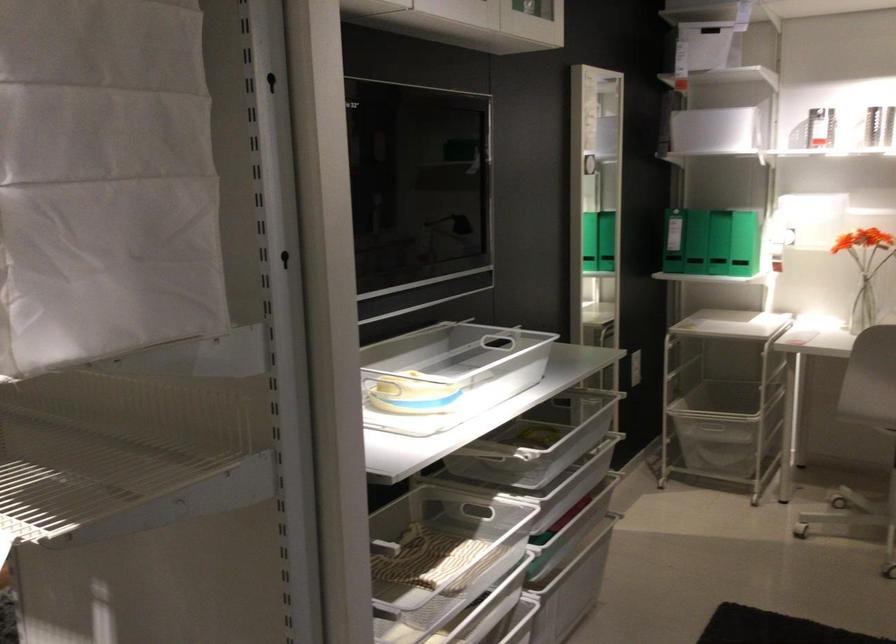
The location [864,308] corresponds to which object?

It refers to a clear glass vase.